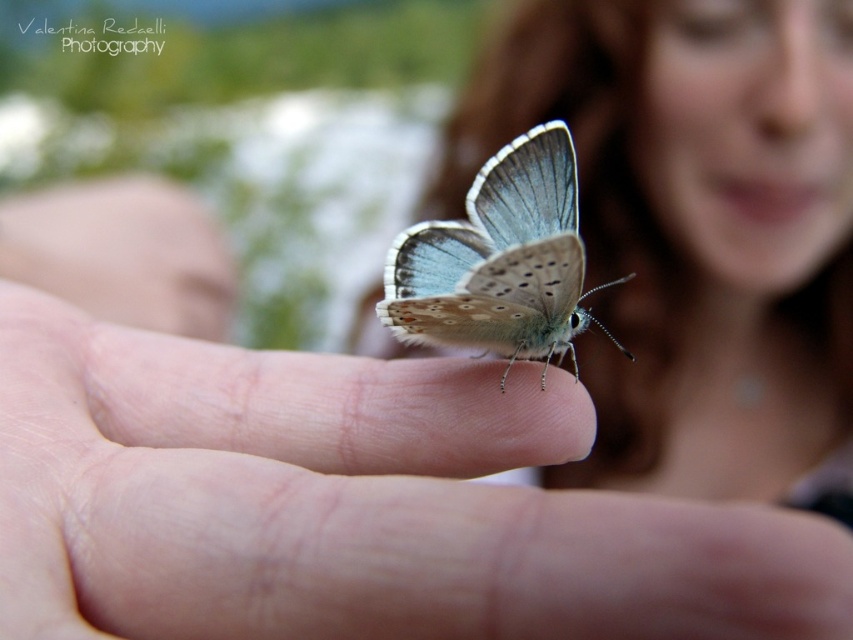
Question: Can you confirm if smooth skin face at upper center is wider than translucent blue wings at center?

Choices:
 (A) no
 (B) yes

Answer: (B)

Question: Does smooth skin face at upper center appear on the left side of translucent blue wings at center?

Choices:
 (A) yes
 (B) no

Answer: (B)

Question: Estimate the real-world distances between objects in this image. Which object is closer to the translucent blue wings at center?

Choices:
 (A) smooth skin finger at center
 (B) smooth skin face at upper center

Answer: (A)

Question: Among these objects, which one is farthest from the camera?

Choices:
 (A) smooth skin finger at center
 (B) smooth skin face at upper center
 (C) translucent blue wings at center

Answer: (B)

Question: Is smooth skin finger at center wider than smooth skin face at upper center?

Choices:
 (A) no
 (B) yes

Answer: (A)

Question: Which object is positioned farthest from the smooth skin face at upper center?

Choices:
 (A) translucent blue wings at center
 (B) smooth skin finger at center

Answer: (B)